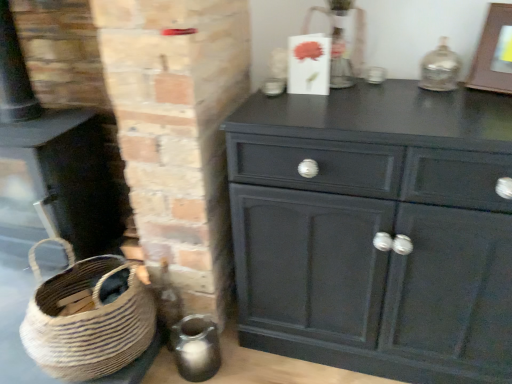
Question: Does natural woven basket at lower left have a larger size compared to matte black cabinet at center?

Choices:
 (A) yes
 (B) no

Answer: (B)

Question: Is natural woven basket at lower left shorter than matte black cabinet at center?

Choices:
 (A) yes
 (B) no

Answer: (A)

Question: Does natural woven basket at lower left appear on the right side of matte black cabinet at center?

Choices:
 (A) no
 (B) yes

Answer: (A)

Question: Considering the relative sizes of natural woven basket at lower left and matte black cabinet at center in the image provided, is natural woven basket at lower left thinner than matte black cabinet at center?

Choices:
 (A) no
 (B) yes

Answer: (B)

Question: Considering the relative sizes of natural woven basket at lower left and matte black cabinet at center in the image provided, is natural woven basket at lower left wider than matte black cabinet at center?

Choices:
 (A) no
 (B) yes

Answer: (A)

Question: Is point 502,82 closer or farther from the camera than point 369,218?

Choices:
 (A) closer
 (B) farther

Answer: (B)

Question: Considering the positions of wooden picture frame at upper right and matte black cabinet at center in the image, is wooden picture frame at upper right wider or thinner than matte black cabinet at center?

Choices:
 (A) thin
 (B) wide

Answer: (A)

Question: From the image's perspective, is wooden picture frame at upper right above or below matte black cabinet at center?

Choices:
 (A) above
 (B) below

Answer: (A)

Question: Would you say wooden picture frame at upper right is inside or outside matte black cabinet at center?

Choices:
 (A) outside
 (B) inside

Answer: (A)

Question: Is point (80, 195) closer or farther from the camera than point (73, 268)?

Choices:
 (A) farther
 (B) closer

Answer: (A)

Question: Looking at their shapes, would you say matte black fireplace at lower left is wider or thinner than natural woven basket at lower left?

Choices:
 (A) thin
 (B) wide

Answer: (B)

Question: Is matte black fireplace at lower left bigger or smaller than natural woven basket at lower left?

Choices:
 (A) small
 (B) big

Answer: (B)

Question: Is matte black fireplace at lower left situated inside natural woven basket at lower left or outside?

Choices:
 (A) outside
 (B) inside

Answer: (A)

Question: Considering the positions of wooden picture frame at upper right and natural woven basket at lower left in the image, is wooden picture frame at upper right taller or shorter than natural woven basket at lower left?

Choices:
 (A) short
 (B) tall

Answer: (A)

Question: From the image's perspective, is wooden picture frame at upper right located above or below natural woven basket at lower left?

Choices:
 (A) above
 (B) below

Answer: (A)